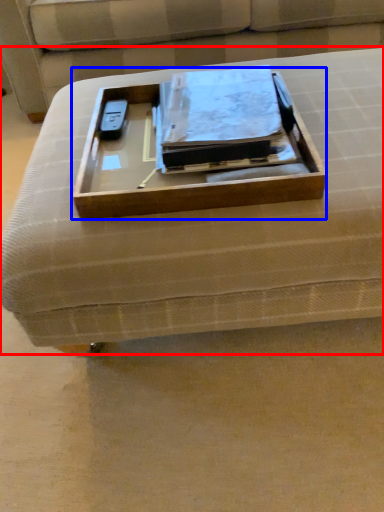
Question: Among these objects, which one is farthest to the camera, furniture (highlighted by a red box) or box (highlighted by a blue box)?

Choices:
 (A) furniture
 (B) box

Answer: (B)